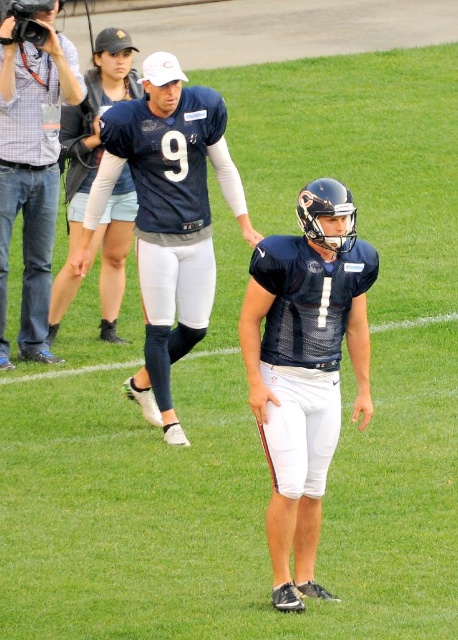
You are a photographer trying to capture a wide shot of the football field. You need to ensure both the navy blue uniform at center and the white matte sideline at lower center are clearly visible in your photo. Which object will appear narrower in the photo?

The navy blue uniform at center will appear narrower in the photo because it is thinner than the white matte sideline at lower center according to the description.

You are a photographer trying to capture a photo of the football players. You have a matte black camera at left and a white matte sideline at lower center in your view. Which object is nearer to you?

The matte black camera at left is closer to the viewer than the white matte sideline at lower center.

You are a photographer trying to capture a candid shot of the football players. You see the point at coordinates (32,172). What object is located at that point?

The point at coordinates (32,172) corresponds to the matte black camera at left.